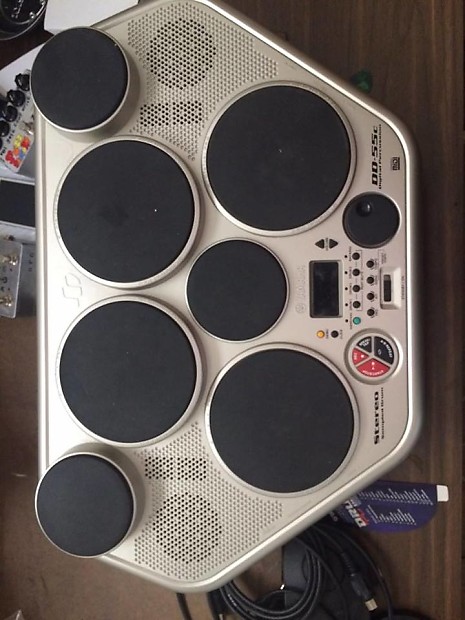
At what (x,y) coordinates should I click in order to perform the action: click on speakers. Please return your answer as a coordinate pair (x, y). Image resolution: width=465 pixels, height=620 pixels. Looking at the image, I should click on (180, 532), (173, 113).